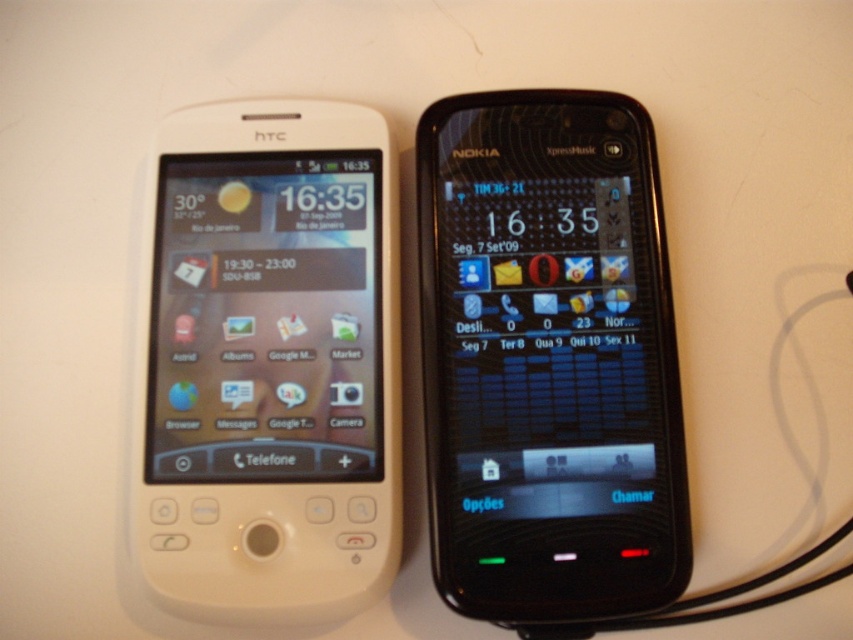
What do you see at coordinates (549, 358) in the screenshot?
I see `black glossy nokia phone at center` at bounding box center [549, 358].

Can you confirm if black glossy nokia phone at center is positioned to the left of white matte htc phone at left?

Incorrect, black glossy nokia phone at center is not on the left side of white matte htc phone at left.

Which is in front, point (422, 348) or point (364, 429)?

Point (364, 429)

Locate an element on the screen. black glossy nokia phone at center is located at coordinates (549, 358).